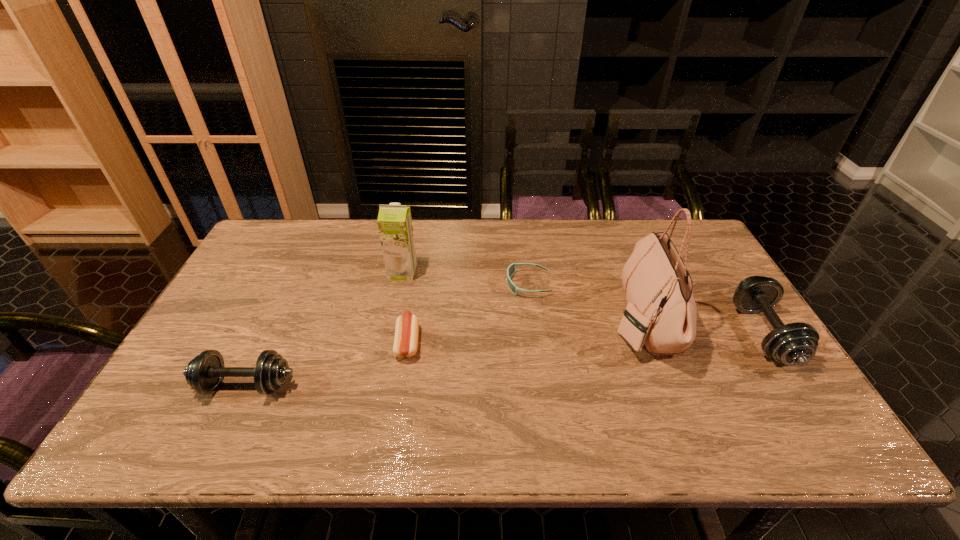
To achieve even spacing by inserting another dumbbell among them, please point to a vacant spot for this new dumbbell. Please provide its 2D coordinates. Your answer should be formatted as a tuple, i.e. [(x, y)], where the tuple contains the x and y coordinates of a point satisfying the conditions above.

[(518, 358)]